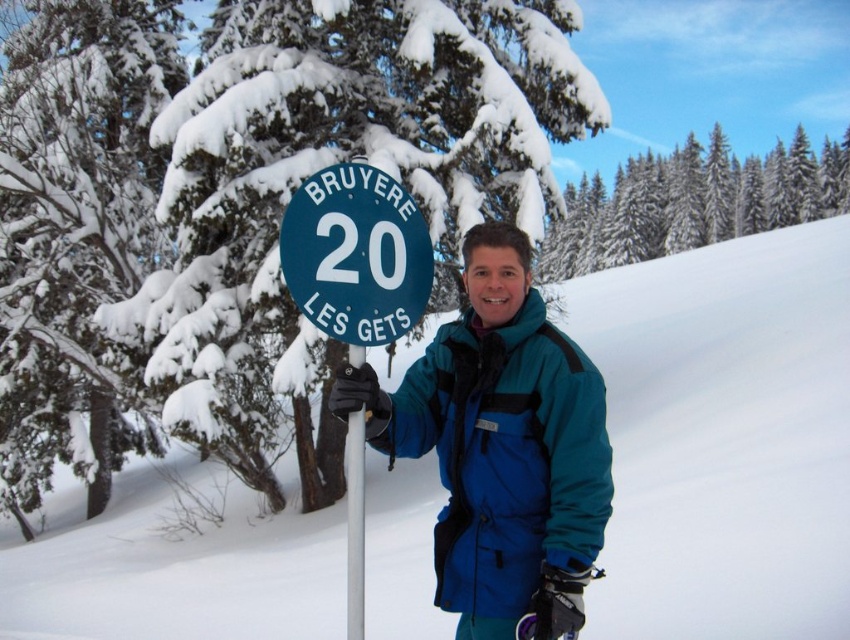
Is snow-covered evergreen at left shorter than green snow-covered trees at upper center?

Indeed, snow-covered evergreen at left has a lesser height compared to green snow-covered trees at upper center.

What do you see at coordinates (75, 228) in the screenshot? This screenshot has height=640, width=850. I see `snow-covered evergreen at left` at bounding box center [75, 228].

Which is behind, point (137, 68) or point (615, 234)?

Point (615, 234)

Locate an element on the screen. The image size is (850, 640). snow-covered evergreen at left is located at coordinates (75, 228).

Between green snow-covered trees at upper center and green plastic sign at center, which one appears on the left side from the viewer's perspective?

green plastic sign at center

Does green snow-covered trees at upper center lie behind green plastic sign at center?

Yes, it is.

Who is more distant from viewer, (624, 205) or (326, 266)?

The point (624, 205) is behind.

Locate an element on the screen. This screenshot has width=850, height=640. green snow-covered trees at upper center is located at coordinates (692, 202).

Does blue synthetic jacket at center appear on the right side of green snow-covered trees at upper center?

No, blue synthetic jacket at center is not to the right of green snow-covered trees at upper center.

Who is taller, blue synthetic jacket at center or green snow-covered trees at upper center?

Standing taller between the two is green snow-covered trees at upper center.

Who is more distant from viewer, (x=454, y=460) or (x=847, y=200)?

Positioned behind is point (x=847, y=200).

Where is `blue synthetic jacket at center`? Image resolution: width=850 pixels, height=640 pixels. blue synthetic jacket at center is located at coordinates (500, 445).